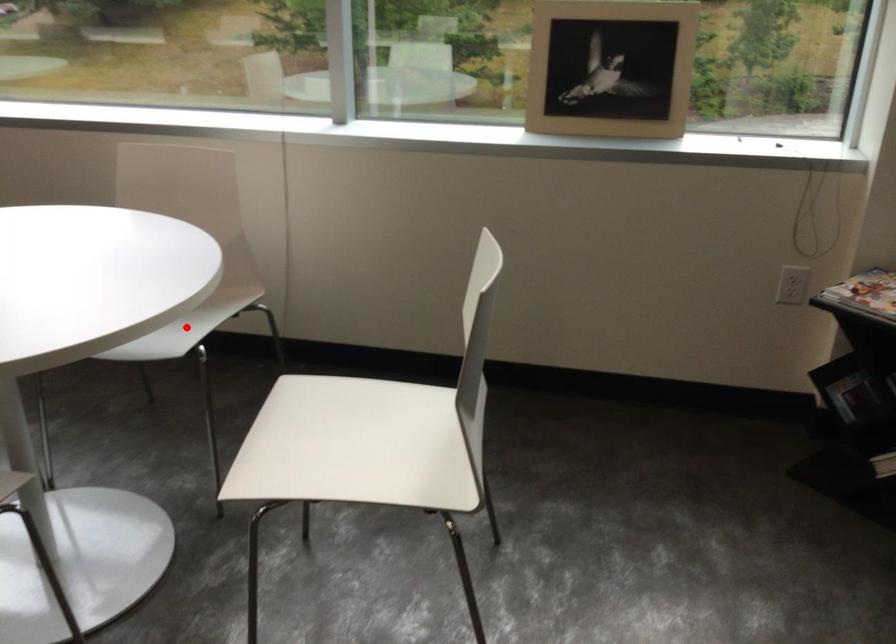
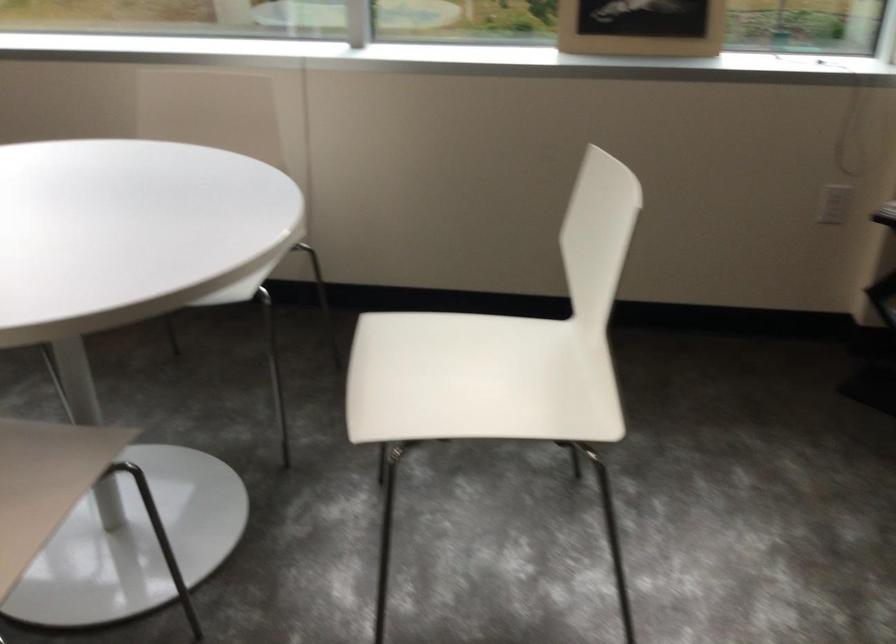
Question: I am providing you with two images of the same scene from different viewpoints. A red point is marked on the first image. Can you still see the location of the red point in image 2?

Choices:
 (A) Yes
 (B) No

Answer: (B)